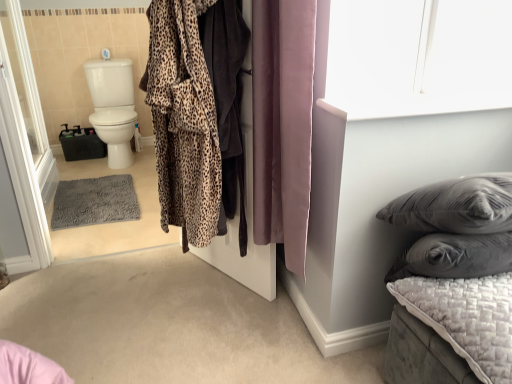
Question: From the image's perspective, is leopard print plush bathrobe at center positioned above or below transparent glass screen door at left?

Choices:
 (A) below
 (B) above

Answer: (A)

Question: Is leopard print plush bathrobe at center wider or thinner than transparent glass screen door at left?

Choices:
 (A) thin
 (B) wide

Answer: (B)

Question: Estimate the real-world distances between objects in this image. Which object is farther from the leopard print robe at center?

Choices:
 (A) leopard print plush bathrobe at center
 (B) quilted gray mattress at lower right
 (C) quilted gray cushion at lower right
 (D) transparent glass screen door at left
 (E) purple velvet curtain at center

Answer: (D)

Question: Considering the real-world distances, which object is farthest from the quilted gray mattress at lower right?

Choices:
 (A) leopard print plush bathrobe at center
 (B) leopard print robe at center
 (C) purple velvet curtain at center
 (D) transparent glass screen door at left
 (E) quilted gray cushion at lower right

Answer: (D)